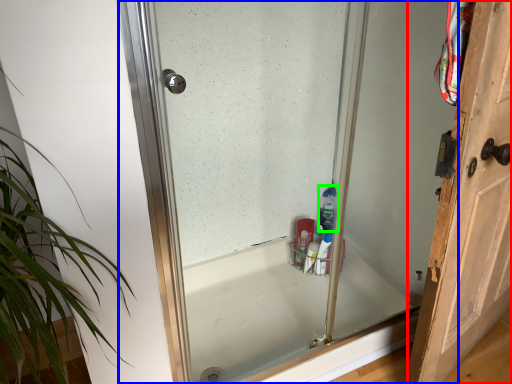
Question: Which object is the closest to the door (highlighted by a red box)? Choose among these: glass door (highlighted by a blue box) or cleaning product (highlighted by a green box).

Choices:
 (A) glass door
 (B) cleaning product

Answer: (B)